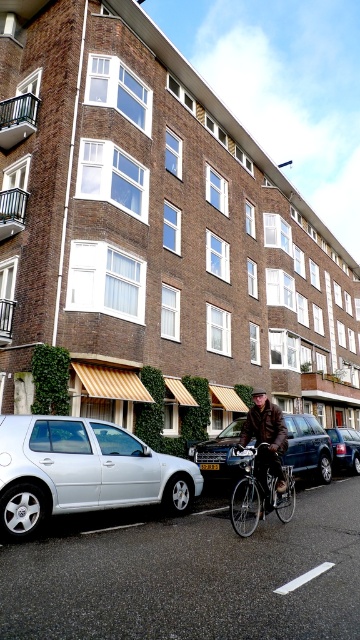
You are standing at the point with coordinates point [240,467] and want to walk towards the point with coordinates point [210,465]. Which direction should you move to get closer to your destination?

You should move backward because point [240,467] is in front of point [210,465], so moving backward will bring you closer to your destination.

You are a delivery person standing at the point marked as point (258,492). You need to deliver a package to the silver hatchback on the left side. Is the silver hatchback on the left side visible from your current position?

The silver metallic bicycle at center is located at point (258,492), which may block the view to the silver hatchback on the left side. Therefore, the silver hatchback on the left side might not be visible from your current position.